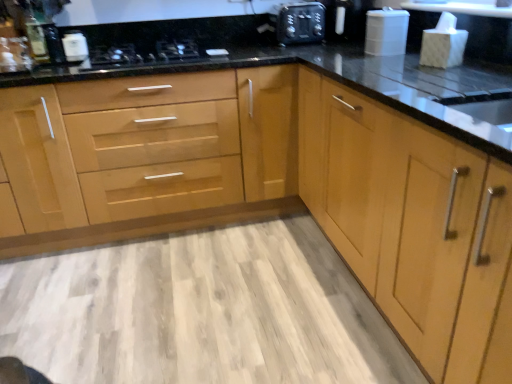
Question: Is matte silver faucet at upper left thinner than matte black sink at right?

Choices:
 (A) yes
 (B) no

Answer: (A)

Question: From a real-world perspective, is matte silver faucet at upper left physically above matte black sink at right?

Choices:
 (A) no
 (B) yes

Answer: (B)

Question: Is the position of matte silver faucet at upper left more distant than that of matte black sink at right?

Choices:
 (A) no
 (B) yes

Answer: (B)

Question: Is matte silver faucet at upper left turned away from matte black sink at right?

Choices:
 (A) no
 (B) yes

Answer: (A)

Question: Considering the relative sizes of matte silver faucet at upper left and matte black sink at right in the image provided, is matte silver faucet at upper left shorter than matte black sink at right?

Choices:
 (A) no
 (B) yes

Answer: (B)

Question: Considering the positions of matte black sink at right and light wood cabinet at right, which appears as the 2th cabinetry when viewed from the left, in the image, is matte black sink at right bigger or smaller than light wood cabinet at right, which appears as the 2th cabinetry when viewed from the left,?

Choices:
 (A) small
 (B) big

Answer: (A)

Question: Is matte black sink at right inside or outside of light wood cabinet at right, which appears as the 2th cabinetry when viewed from the left?

Choices:
 (A) outside
 (B) inside

Answer: (B)

Question: Is matte black sink at right wider or thinner than light wood cabinet at right, the first cabinetry viewed from the right?

Choices:
 (A) thin
 (B) wide

Answer: (A)

Question: Is point (446, 119) positioned closer to the camera than point (439, 258)?

Choices:
 (A) farther
 (B) closer

Answer: (B)

Question: Based on their positions, is white glossy container at upper left, arranged as the 1th appliance when viewed from the left, located to the left or right of matte black sink at right?

Choices:
 (A) left
 (B) right

Answer: (A)

Question: Is white glossy container at upper left, arranged as the second appliance when viewed from the right, inside or outside of matte black sink at right?

Choices:
 (A) outside
 (B) inside

Answer: (A)

Question: Is white glossy container at upper left, arranged as the second appliance when viewed from the right, wider or thinner than matte black sink at right?

Choices:
 (A) thin
 (B) wide

Answer: (A)

Question: Does point (76, 33) appear closer or farther from the camera than point (463, 114)?

Choices:
 (A) farther
 (B) closer

Answer: (A)

Question: Does point (15, 64) appear closer or farther from the camera than point (496, 304)?

Choices:
 (A) closer
 (B) farther

Answer: (B)

Question: In the image, is matte silver faucet at upper left positioned in front of or behind light wood cabinet at right, the first cabinetry viewed from the right?

Choices:
 (A) front
 (B) behind

Answer: (B)